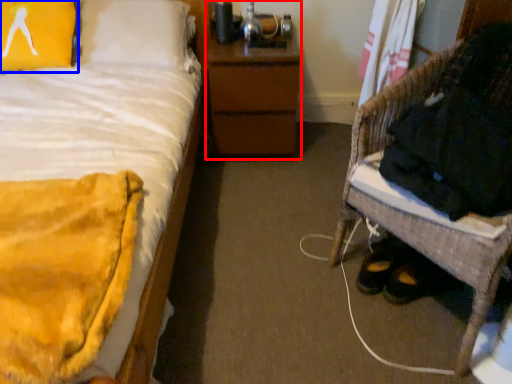
Question: Which object is closer to the camera taking this photo, nightstand (highlighted by a red box) or pillow (highlighted by a blue box)?

Choices:
 (A) nightstand
 (B) pillow

Answer: (B)